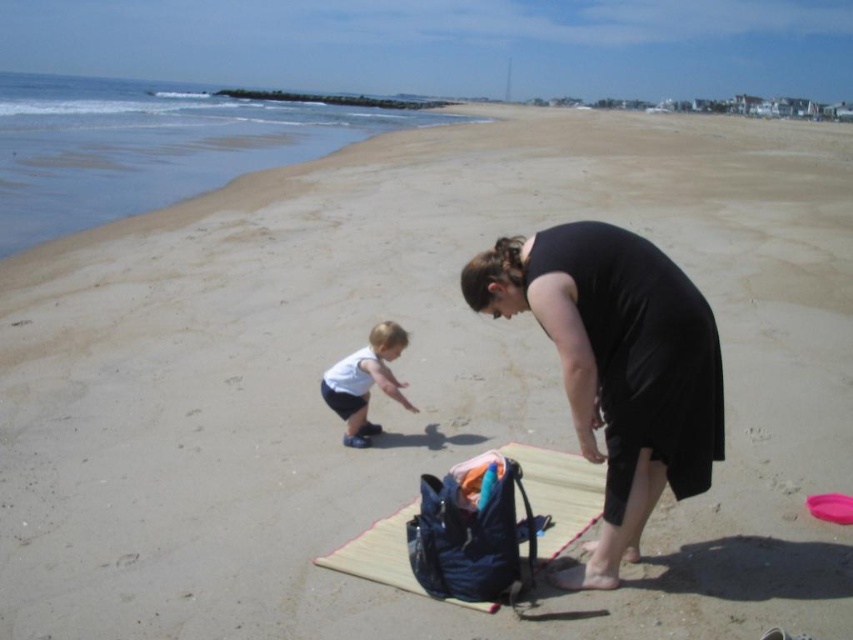
You are planning to lay out a picnic on the beach. You have a black matte dress at center and a beige woven mat at center. Which object should you move to make space for the picnic blanket?

The black matte dress at center might be wider than the beige woven mat at center, so moving the black matte dress at center would create more space for the picnic blanket.

You are a photographer trying to capture a candid shot of the black matte dress at center while keeping your camera out of sight. The camera is currently 10.02 feet away from the dress. If you move closer by 3 feet, will the camera still be out of sight?

The camera is currently 10.02 feet away from the black matte dress at center. Moving closer by 3 feet would reduce the distance to approximately 7.02 feet. However, since the exact visibility conditions aren not specified, it is uncertain if the camera would remain out of sight at this new distance.

You are a photographer trying to capture the black matte dress at center in your shot. The camera is positioned at point A, which is at coordinates 0.5, 0.5. What direction should you move the camera to get the dress in frame?

The black matte dress at center is located at coordinates (618,365), which is northeast of the camera position at (426,320). Move the camera slightly to the northeast to center the dress in the frame.